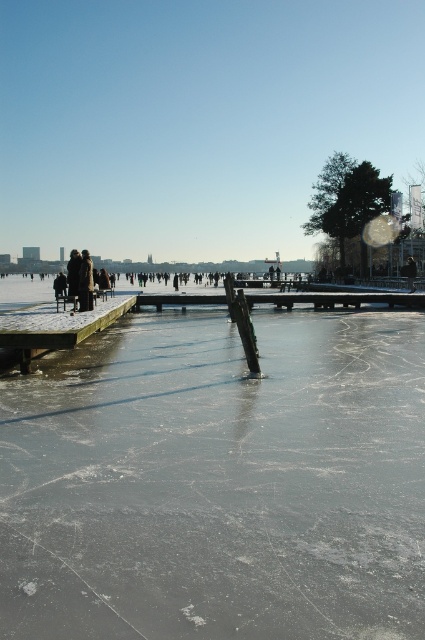
Question: Which point is farther from the camera taking this photo?

Choices:
 (A) (79, 272)
 (B) (59, 348)

Answer: (A)

Question: Considering the relative positions of smooth ice rink at center and dark brown leather jacket at left in the image provided, where is smooth ice rink at center located with respect to dark brown leather jacket at left?

Choices:
 (A) left
 (B) right

Answer: (B)

Question: In this image, where is wooden dock at left located relative to dark brown leather jacket at left?

Choices:
 (A) below
 (B) above

Answer: (A)

Question: Which object appears closest to the camera in this image?

Choices:
 (A) smooth ice rink at center
 (B) wooden dock at left
 (C) dark brown leather jacket at left
 (D) dark brown fur coat at left

Answer: (A)

Question: Which of these objects is positioned closest to the smooth ice rink at center?

Choices:
 (A) dark brown fur coat at left
 (B) dark brown leather jacket at left
 (C) wooden dock at left

Answer: (C)

Question: Is smooth ice rink at center in front of dark brown fur coat at left?

Choices:
 (A) yes
 (B) no

Answer: (A)